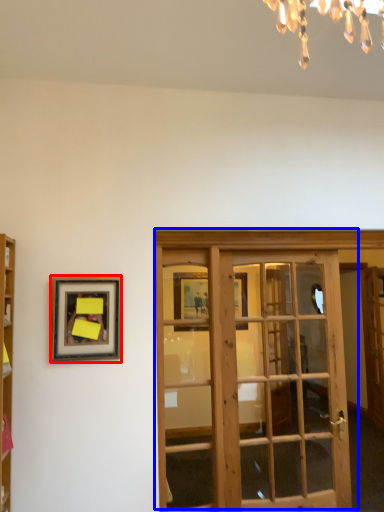
Question: Which object is closer to the camera taking this photo, picture frame (highlighted by a red box) or door (highlighted by a blue box)?

Choices:
 (A) picture frame
 (B) door

Answer: (A)